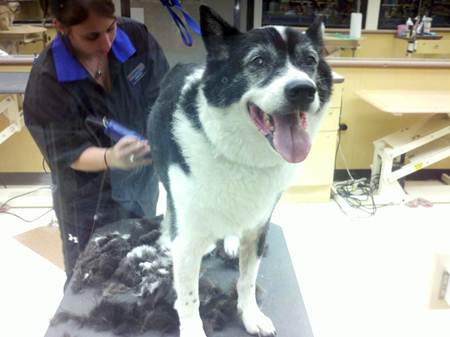
Find the location of a particular element. This screenshot has height=337, width=450. floor is located at coordinates (347, 272).